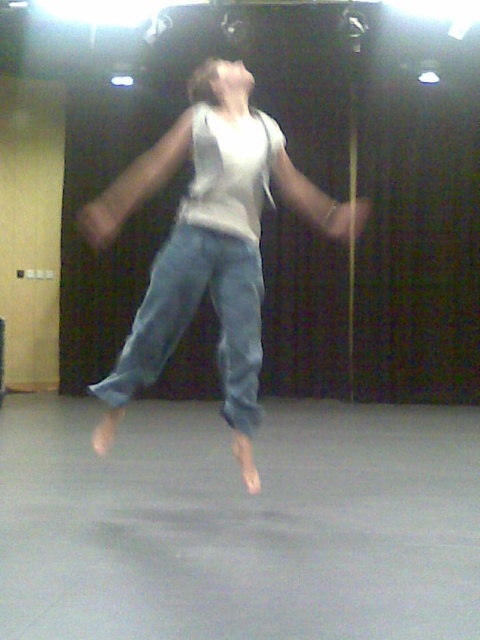
Question: Which point is closer to the camera?

Choices:
 (A) denim at center
 (B) white cotton tank top at center

Answer: (A)

Question: Can you confirm if white cotton tank top at center is bigger than denim at center?

Choices:
 (A) yes
 (B) no

Answer: (A)

Question: Which point appears closest to the camera in this image?

Choices:
 (A) (212, 241)
 (B) (332, 224)

Answer: (A)

Question: Does white cotton tank top at center have a larger size compared to denim at center?

Choices:
 (A) yes
 (B) no

Answer: (A)

Question: Can you confirm if white cotton tank top at center is wider than denim at center?

Choices:
 (A) no
 (B) yes

Answer: (A)

Question: Among these points, which one is farthest from the camera?

Choices:
 (A) (218, 252)
 (B) (164, 275)

Answer: (B)